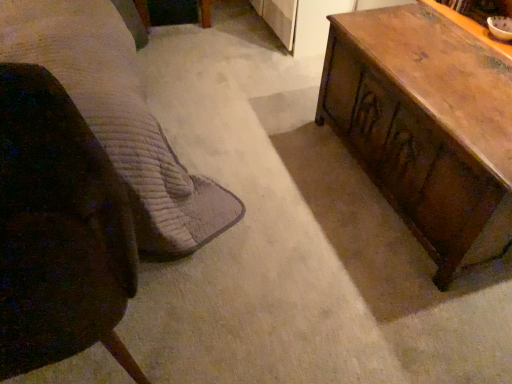
Question: Based on their positions, is dark brown leather chair at left located to the left or right of brown quilted fabric bed at left?

Choices:
 (A) left
 (B) right

Answer: (B)

Question: Is point (0, 291) positioned closer to the camera than point (132, 48)?

Choices:
 (A) closer
 (B) farther

Answer: (A)

Question: Which object is the farthest from the dark brown leather chair at left?

Choices:
 (A) wooden trunk at right
 (B) brown quilted fabric bed at left

Answer: (A)

Question: Which object is the closest to the brown quilted fabric bed at left?

Choices:
 (A) dark brown leather chair at left
 (B) wooden trunk at right

Answer: (A)